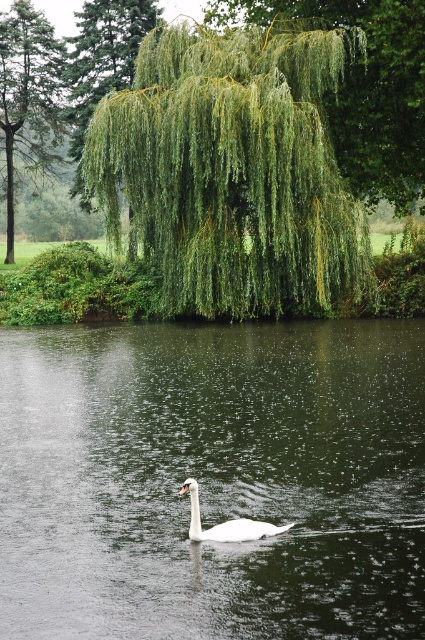
You are standing at the edge of the pond and want to find the clearest part of the water. According to the scene, where is the clear water at center in relation to the green leafy tree at upper center?

The clear water at center is located below the green leafy tree at upper center, so the clearest part of the water is directly underneath the tree.

From the picture: You are standing on the shore of the pond and want to take a photo of the white glossy swan at center. To avoid the green leafy willow at upper center from blocking the view, where should you position yourself relative to the swan?

To avoid the green leafy willow at upper center blocking the view, you should position yourself behind the white glossy swan at center since the willow is located above the swan, placing you behind would allow you to capture the swan without the willow obstructing it.

You are a birdwatcher observing the scene. You notice the green leafy willow at upper center and the white glossy swan at center. Which object is taller in the image?

The green leafy willow at upper center is taller than the white glossy swan at center.